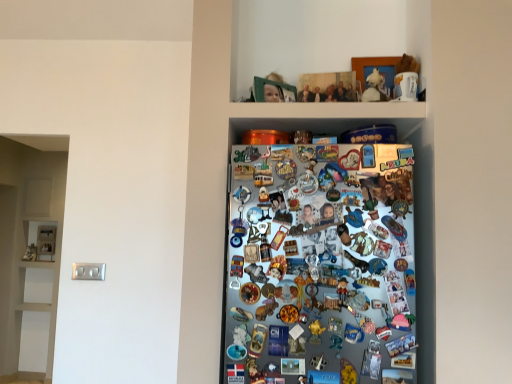
The width and height of the screenshot is (512, 384). Describe the element at coordinates (316, 332) in the screenshot. I see `gold plastic toy at center, the second toy positioned from the top` at that location.

This screenshot has width=512, height=384. In order to click on gold plastic toy at center, the first toy ordered from the bottom in this screenshot , I will do `click(316, 332)`.

The height and width of the screenshot is (384, 512). Describe the element at coordinates (374, 88) in the screenshot. I see `white plush toy at upper center, acting as the first toy starting from the top` at that location.

The height and width of the screenshot is (384, 512). I want to click on white plush toy at upper center, arranged as the 2th toy when ordered from the bottom, so click(x=374, y=88).

Locate an element on the screen. The height and width of the screenshot is (384, 512). gold plastic toy at center, the second toy positioned from the top is located at coordinates (316, 332).

Considering the relative positions of white plush toy at upper center, the second toy positioned from the front, and gold plastic toy at center, the second toy viewed from the back, in the image provided, is white plush toy at upper center, the second toy positioned from the front, to the right of gold plastic toy at center, the second toy viewed from the back, from the viewer's perspective?

Yes, white plush toy at upper center, the second toy positioned from the front, is to the right of gold plastic toy at center, the second toy viewed from the back.

From the picture: Does white plush toy at upper center, the first toy when ordered from back to front, come in front of gold plastic toy at center, the first toy ordered from the bottom?

No, white plush toy at upper center, the first toy when ordered from back to front, is further to the viewer.

Which point is more distant from viewer, [375,97] or [318,324]?

The point [375,97] is farther.

From the image's perspective, who appears lower, white plush toy at upper center, positioned as the 2th toy in left-to-right order, or gold plastic toy at center, the first toy when ordered from left to right?

gold plastic toy at center, the first toy when ordered from left to right.

From a real-world perspective, between white plush toy at upper center, the first toy when ordered from back to front, and gold plastic toy at center, the second toy viewed from the back, who is vertically lower?

gold plastic toy at center, the second toy viewed from the back, from a real-world perspective.

Between white plush toy at upper center, which is the first toy from right to left, and gold plastic toy at center, the second toy positioned from the top, which one has smaller width?

gold plastic toy at center, the second toy positioned from the top.

Can you confirm if white plush toy at upper center, the second toy positioned from the front, is taller than gold plastic toy at center, the first toy ordered from the bottom?

Yes.

Does white plush toy at upper center, positioned as the 2th toy in left-to-right order, have a smaller size compared to gold plastic toy at center, the first toy when ordered from left to right?

Incorrect, white plush toy at upper center, positioned as the 2th toy in left-to-right order, is not smaller in size than gold plastic toy at center, the first toy when ordered from left to right.

Is gold plastic toy at center, the first toy ordered from the bottom, inside white plush toy at upper center, the first toy when ordered from back to front?

No, white plush toy at upper center, the first toy when ordered from back to front, does not contain gold plastic toy at center, the first toy ordered from the bottom.

Is white plush toy at upper center, which is the first toy from right to left, not near gold plastic toy at center, which ranks as the 1th toy in front-to-back order?

Actually, white plush toy at upper center, which is the first toy from right to left, and gold plastic toy at center, which ranks as the 1th toy in front-to-back order, are a little close together.

Is white plush toy at upper center, the first toy when ordered from back to front, positioned with its back to gold plastic toy at center, the first toy when ordered from left to right?

That's not correct — white plush toy at upper center, the first toy when ordered from back to front, is not looking away from gold plastic toy at center, the first toy when ordered from left to right.

How distant is white plush toy at upper center, arranged as the 2th toy when ordered from the bottom, from gold plastic toy at center, which ranks as the 1th toy in front-to-back order?

A distance of 34.83 inches exists between white plush toy at upper center, arranged as the 2th toy when ordered from the bottom, and gold plastic toy at center, which ranks as the 1th toy in front-to-back order.

Locate an element on the screen. The width and height of the screenshot is (512, 384). toy that is under the white plush toy at upper center, the first toy when ordered from back to front (from a real-world perspective) is located at coordinates (316, 332).

Which is more to the right, gold plastic toy at center, which ranks as the 1th toy in front-to-back order, or white plush toy at upper center, which is the first toy from right to left?

white plush toy at upper center, which is the first toy from right to left.

Based on the photo, in the image, is gold plastic toy at center, the first toy when ordered from left to right, positioned in front of or behind white plush toy at upper center, positioned as the 2th toy in left-to-right order?

gold plastic toy at center, the first toy when ordered from left to right, is positioned closer to the viewer than white plush toy at upper center, positioned as the 2th toy in left-to-right order.

Is point (316, 326) closer or farther from the camera than point (373, 92)?

Point (316, 326) is positioned closer to the camera compared to point (373, 92).

From the image's perspective, is gold plastic toy at center, the first toy when ordered from left to right, located above or below white plush toy at upper center, the first toy when ordered from back to front?

Clearly, from the image's perspective, gold plastic toy at center, the first toy when ordered from left to right, is below white plush toy at upper center, the first toy when ordered from back to front.

From a real-world perspective, is gold plastic toy at center, the first toy when ordered from left to right, positioned over white plush toy at upper center, the second toy positioned from the front, based on gravity?

No, from a real-world perspective, gold plastic toy at center, the first toy when ordered from left to right, is not on top of white plush toy at upper center, the second toy positioned from the front.

Is gold plastic toy at center, the second toy viewed from the back, wider or thinner than white plush toy at upper center, positioned as the 2th toy in left-to-right order?

gold plastic toy at center, the second toy viewed from the back, is thinner than white plush toy at upper center, positioned as the 2th toy in left-to-right order.

Consider the image. Considering the sizes of objects gold plastic toy at center, the first toy ordered from the bottom, and white plush toy at upper center, acting as the first toy starting from the top, in the image provided, who is shorter, gold plastic toy at center, the first toy ordered from the bottom, or white plush toy at upper center, acting as the first toy starting from the top,?

gold plastic toy at center, the first toy ordered from the bottom.

Can you confirm if gold plastic toy at center, which ranks as the 1th toy in front-to-back order, is smaller than white plush toy at upper center, acting as the first toy starting from the top?

Yes.

Is gold plastic toy at center, the first toy ordered from the bottom, outside of white plush toy at upper center, positioned as the 2th toy in left-to-right order?

Indeed, gold plastic toy at center, the first toy ordered from the bottom, is completely outside white plush toy at upper center, positioned as the 2th toy in left-to-right order.

Is gold plastic toy at center, the first toy ordered from the bottom, touching white plush toy at upper center, the first toy when ordered from back to front?

gold plastic toy at center, the first toy ordered from the bottom, and white plush toy at upper center, the first toy when ordered from back to front, are not in contact.

Is gold plastic toy at center, the first toy when ordered from left to right, facing towards white plush toy at upper center, positioned as the 2th toy in left-to-right order?

No, gold plastic toy at center, the first toy when ordered from left to right, is not oriented towards white plush toy at upper center, positioned as the 2th toy in left-to-right order.

How many degrees apart are the facing directions of gold plastic toy at center, the second toy in the right-to-left sequence, and white plush toy at upper center, which is the first toy from right to left?

12 degrees.

Could you measure the distance between gold plastic toy at center, the second toy viewed from the back, and white plush toy at upper center, which is the first toy from right to left?

They are 34.83 inches apart.

At what (x,y) coordinates should I click in order to perform the action: click on toy located below the white plush toy at upper center, which is the first toy from right to left (from the image's perspective). Please return your answer as a coordinate pair (x, y). The image size is (512, 384). Looking at the image, I should click on (316, 332).

What are the coordinates of `toy above the gold plastic toy at center, the second toy in the right-to-left sequence (from a real-world perspective)` in the screenshot? It's located at (374, 88).

The height and width of the screenshot is (384, 512). I want to click on toy that is above the gold plastic toy at center, the second toy positioned from the top (from the image's perspective), so click(x=374, y=88).